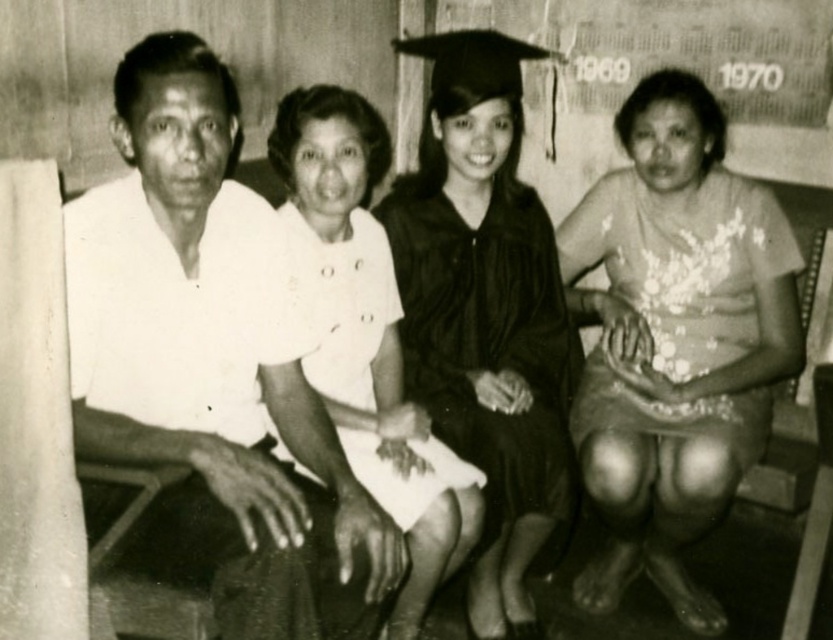
Does point (280, 285) come farther from viewer compared to point (323, 269)?

No.

Is point (93, 298) positioned in front of point (320, 115)?

Yes, point (93, 298) is in front of point (320, 115).

Identify the location of white matte shirt at left. (215, 355).

Can you confirm if matte black graduation gown at center is positioned above white satin dress at center?

Indeed, matte black graduation gown at center is positioned over white satin dress at center.

This screenshot has height=640, width=833. What do you see at coordinates (485, 310) in the screenshot? I see `matte black graduation gown at center` at bounding box center [485, 310].

This screenshot has height=640, width=833. What do you see at coordinates (485, 310) in the screenshot?
I see `matte black graduation gown at center` at bounding box center [485, 310].

At what (x,y) coordinates should I click in order to perform the action: click on matte black graduation gown at center. Please return your answer as a coordinate pair (x, y). Looking at the image, I should click on (485, 310).

The height and width of the screenshot is (640, 833). Identify the location of white floral dress at center. (676, 340).

Is white floral dress at center above matte black graduation gown at center?

No, white floral dress at center is not above matte black graduation gown at center.

Locate an element on the screen. The image size is (833, 640). white floral dress at center is located at coordinates tap(676, 340).